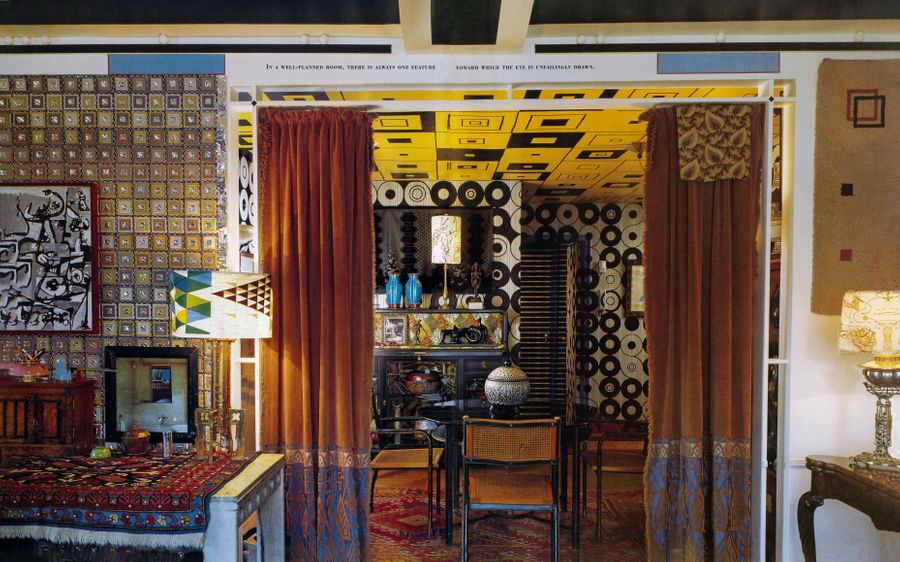
At what (x,y) coordinates should I click in order to perform the action: click on curtains. Please return your answer as a coordinate pair (x, y). This screenshot has height=562, width=900. Looking at the image, I should click on (702, 398), (349, 362).